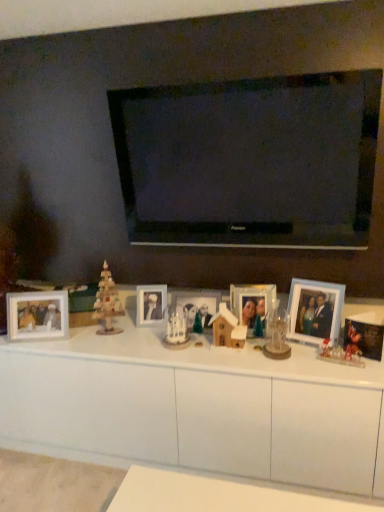
Question: From the image's perspective, is white glossy cabinet at center above wooden christmas tree at left?

Choices:
 (A) no
 (B) yes

Answer: (A)

Question: Is there a large distance between white glossy cabinet at center and wooden christmas tree at left?

Choices:
 (A) no
 (B) yes

Answer: (A)

Question: Can you confirm if white glossy cabinet at center is wider than wooden christmas tree at left?

Choices:
 (A) yes
 (B) no

Answer: (A)

Question: Is white glossy cabinet at center further to the viewer compared to wooden christmas tree at left?

Choices:
 (A) yes
 (B) no

Answer: (B)

Question: From a real-world perspective, is white glossy cabinet at center over wooden christmas tree at left?

Choices:
 (A) no
 (B) yes

Answer: (A)

Question: Considering the relative positions of light blue plastic picture frame at right, which appears as the 2th picture frame when viewed from the right, and matte white photo frame at center, the 5th picture frame viewed from the right, in the image provided, is light blue plastic picture frame at right, which appears as the 2th picture frame when viewed from the right, to the left or to the right of matte white photo frame at center, the 5th picture frame viewed from the right,?

Choices:
 (A) left
 (B) right

Answer: (B)

Question: Based on their sizes in the image, would you say light blue plastic picture frame at right, which appears as the 2th picture frame when viewed from the right, is bigger or smaller than matte white photo frame at center, acting as the 2th picture frame starting from the left?

Choices:
 (A) big
 (B) small

Answer: (A)

Question: Is light blue plastic picture frame at right, which appears as the 2th picture frame when viewed from the right, spatially inside matte white photo frame at center, the 5th picture frame viewed from the right, or outside of it?

Choices:
 (A) outside
 (B) inside

Answer: (A)

Question: Is light blue plastic picture frame at right, marked as the 5th picture frame in a left-to-right arrangement, in front of or behind matte white photo frame at center, acting as the 2th picture frame starting from the left, in the image?

Choices:
 (A) behind
 (B) front

Answer: (B)

Question: In the image, is translucent plastic gingerbread house at lower right, acting as the 1th toy starting from the right, positioned in front of or behind wooden christmas tree at left?

Choices:
 (A) behind
 (B) front

Answer: (B)

Question: Is point (334, 348) positioned closer to the camera than point (117, 304)?

Choices:
 (A) farther
 (B) closer

Answer: (B)

Question: From a real-world perspective, is translucent plastic gingerbread house at lower right, which appears as the first toy when viewed from the front, positioned above or below wooden christmas tree at left?

Choices:
 (A) above
 (B) below

Answer: (B)

Question: Based on their sizes in the image, would you say translucent plastic gingerbread house at lower right, the 2th toy positioned from the back, is bigger or smaller than wooden christmas tree at left?

Choices:
 (A) big
 (B) small

Answer: (B)

Question: Considering their positions, is wooden photo frame at left, placed as the first picture frame when sorted from left to right, located in front of or behind clear glass photo frame at center, positioned as the 4th picture frame in left-to-right order?

Choices:
 (A) front
 (B) behind

Answer: (B)

Question: From their relative heights in the image, would you say wooden photo frame at left, marked as the sixth picture frame in a right-to-left arrangement, is taller or shorter than clear glass photo frame at center, the third picture frame from the right?

Choices:
 (A) tall
 (B) short

Answer: (A)